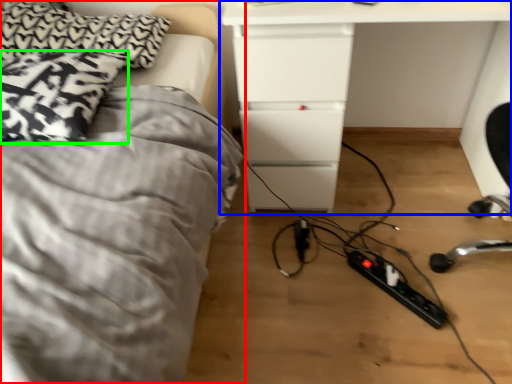
Question: Which object is positioned farthest from bed (highlighted by a red box)? Select from table (highlighted by a blue box) and pillow (highlighted by a green box).

Choices:
 (A) table
 (B) pillow

Answer: (A)